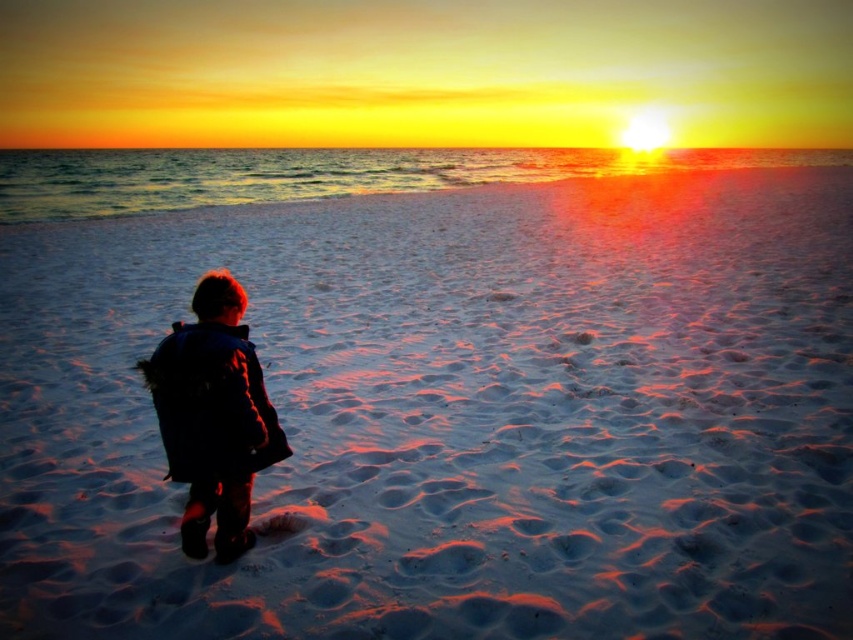
Based on the photo, between white sandy beach at center and dark blue jacket at lower left, which one appears on the right side from the viewer's perspective?

Positioned to the right is white sandy beach at center.

Is white sandy beach at center bigger than dark blue jacket at lower left?

Yes.

Identify the location of white sandy beach at center. (454, 413).